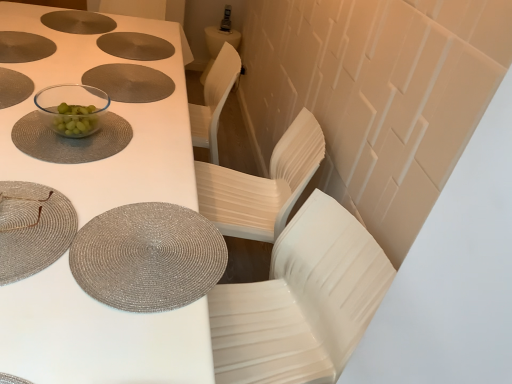
Find the location of a particular element. vacant area that lies between silver textured placemat at lower left, the fourth tableware positioned from the back, and matte silver placemat at center is located at coordinates (133, 145).